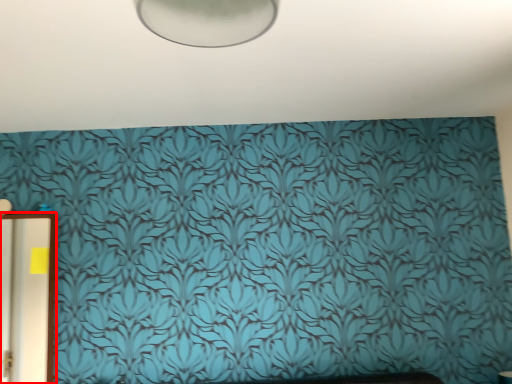
Question: Considering the relative positions of door (annotated by the red box) and backdrop in the image provided, where is door (annotated by the red box) located with respect to the staircase?

Choices:
 (A) right
 (B) left

Answer: (B)